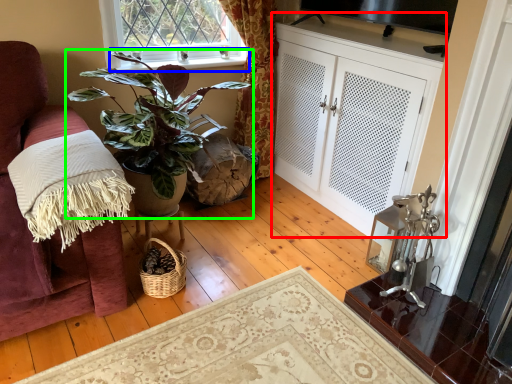
Question: Which is nearer to the cabinetry (highlighted by a red box)? window sill (highlighted by a blue box) or houseplant (highlighted by a green box).

Choices:
 (A) window sill
 (B) houseplant

Answer: (A)